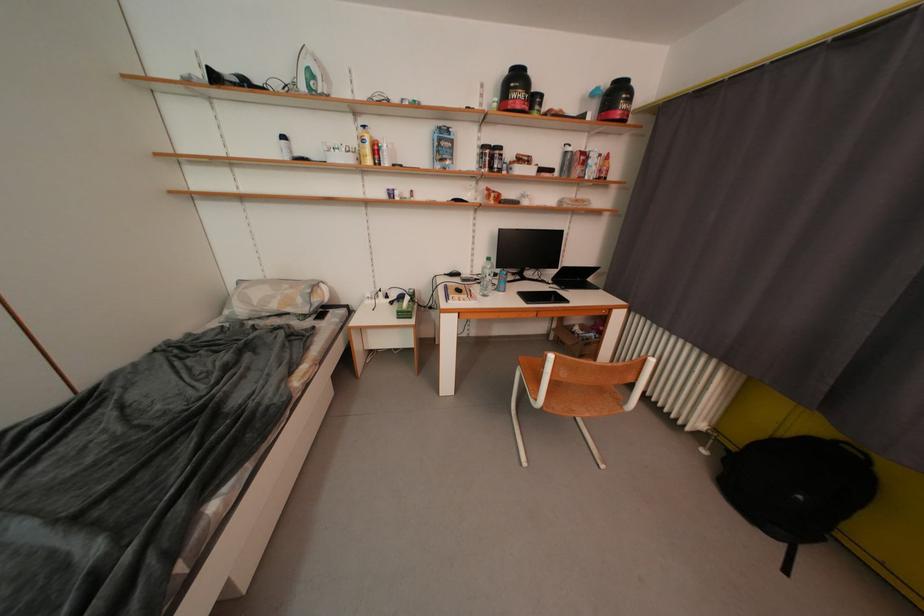
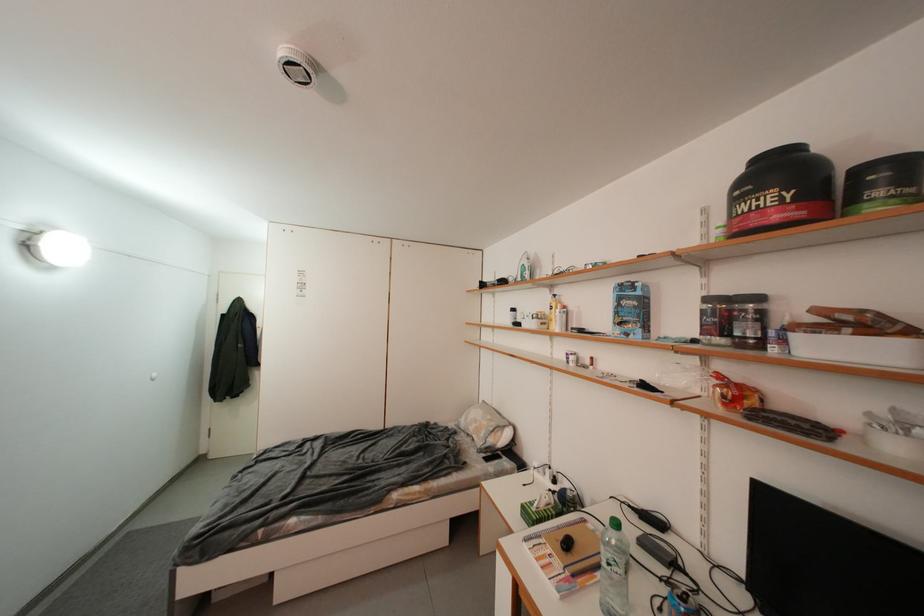
Locate, in the second image, the point that corresponds to (x=406, y=315) in the first image.

(530, 509)